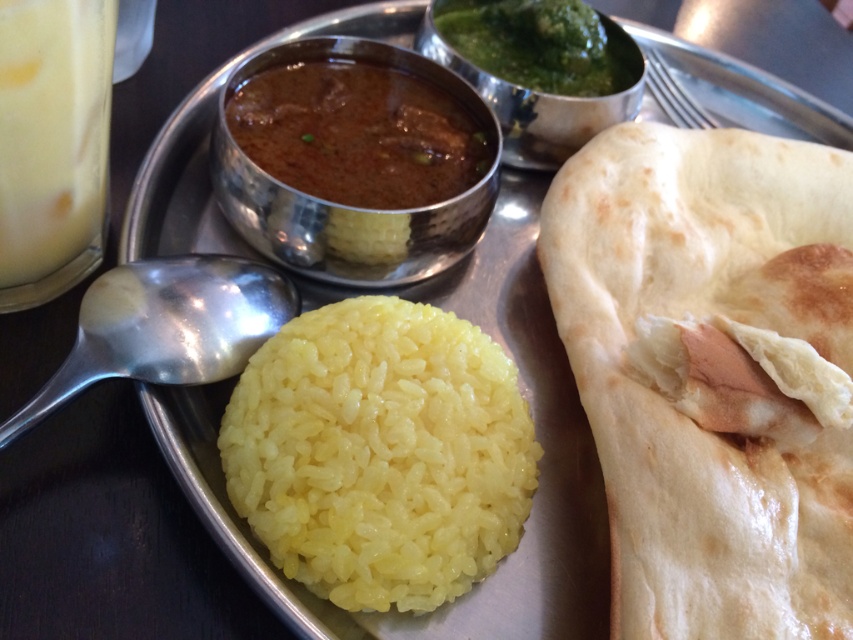
You are a food critic analyzing the composition of this Indian meal. The yellow polished rice at center is represented by point (x=380, y=452). Where is the naan bread located relative to this point?

The naan bread is located to the right of the yellow polished rice at center, as it is positioned to the right of the point (x=380, y=452).

You are a guest at an Indian meal and see the yellow polished rice at center and the milky white liquid at left. Which dish is placed higher on the tray?

The milky white liquid at left is placed higher on the tray because the yellow polished rice at center is located below it.